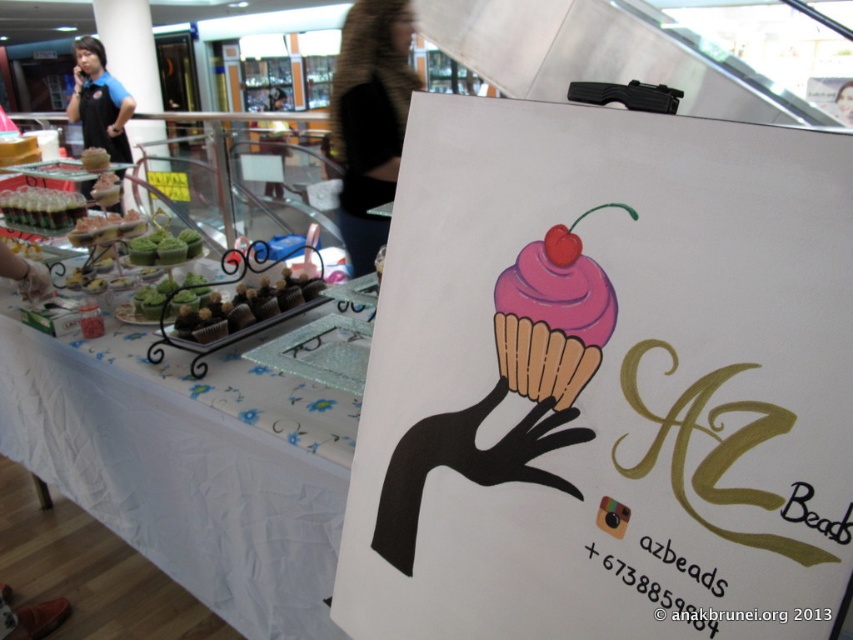
In the scene shown: Does white fabric tablecloth at lower left appear on the right side of pink matte cupcake at center?

Incorrect, white fabric tablecloth at lower left is not on the right side of pink matte cupcake at center.

Does white fabric tablecloth at lower left have a greater width compared to pink matte cupcake at center?

Indeed, white fabric tablecloth at lower left has a greater width compared to pink matte cupcake at center.

Which is in front, point (262, 490) or point (566, 253)?

Point (566, 253) is in front.

The width and height of the screenshot is (853, 640). I want to click on white fabric tablecloth at lower left, so click(190, 470).